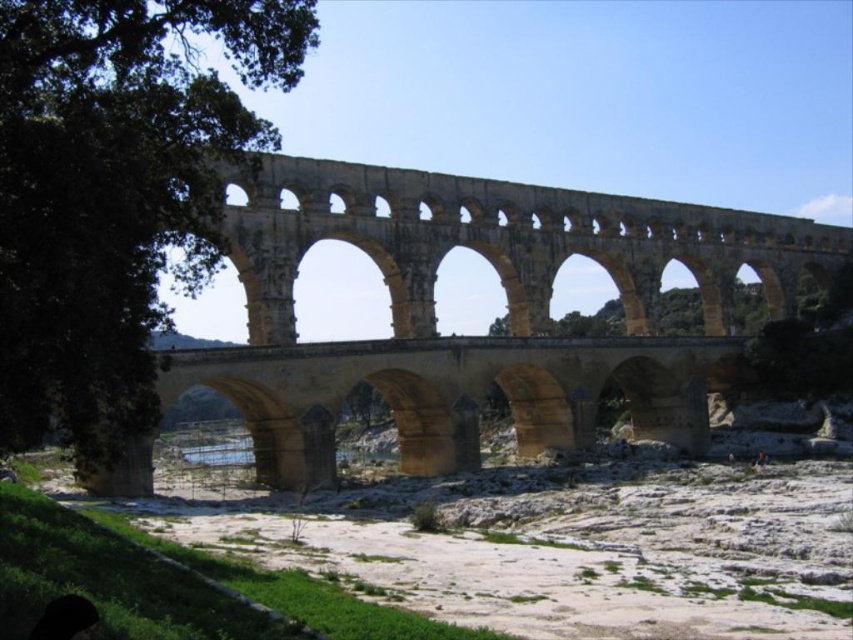
Does point (567, 384) lie in front of point (164, 205)?

No, (567, 384) is behind (164, 205).

From the picture: Does yellow stone bridge at center have a lesser width compared to green leafy tree at left?

In fact, yellow stone bridge at center might be wider than green leafy tree at left.

The image size is (853, 640). I want to click on yellow stone bridge at center, so click(x=476, y=337).